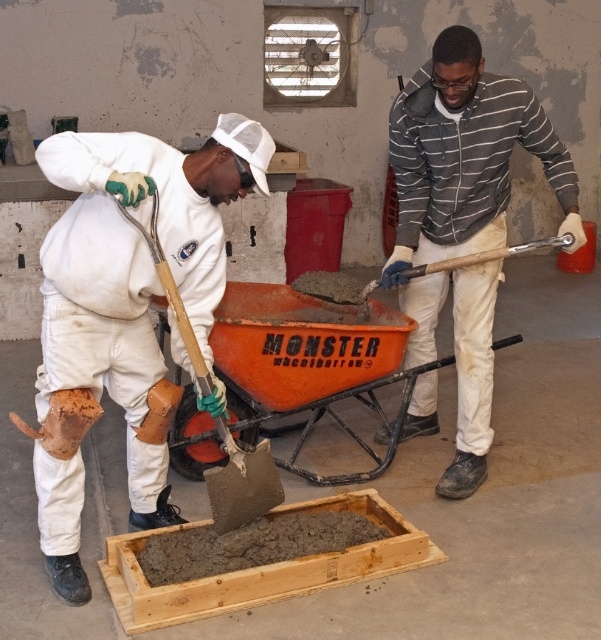
You are a construction worker who needs to move the striped cotton hoodie at center to a storage room located 2 meters away from the wooden shovel at center. Can you carry the hoodie and the shovel together without exceeding the 1.5 meters maximum distance you can comfortably carry both items?

The distance between the striped cotton hoodie at center and wooden shovel at center is 1.10 meters. Since the maximum comfortable carrying distance is 1.5 meters, you can carry both items together as the combined distance required is within the limit.

You are a construction worker who needs to transport a heavy load of cement. Given that the orange plastic wheelbarrow at center is larger than the wooden shovel at center, which object would be more suitable for carrying the cement?

The orange plastic wheelbarrow at center is more suitable for carrying the cement because it has a larger size compared to the wooden shovel at center, making it capable of holding more material.